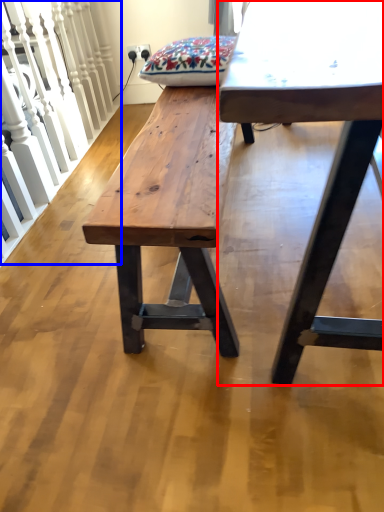
Question: Among these objects, which one is farthest to the camera, table (highlighted by a red box) or rail (highlighted by a blue box)?

Choices:
 (A) table
 (B) rail

Answer: (B)